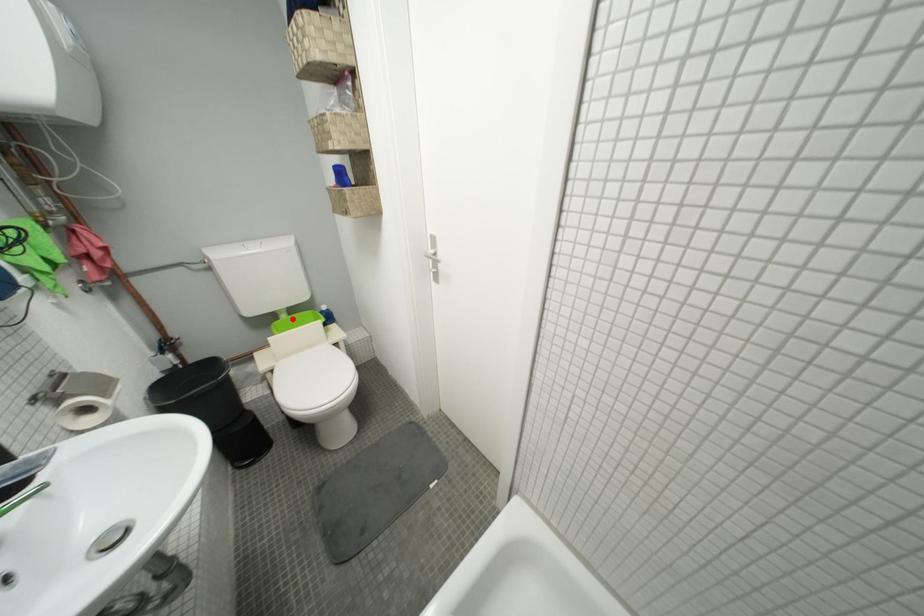
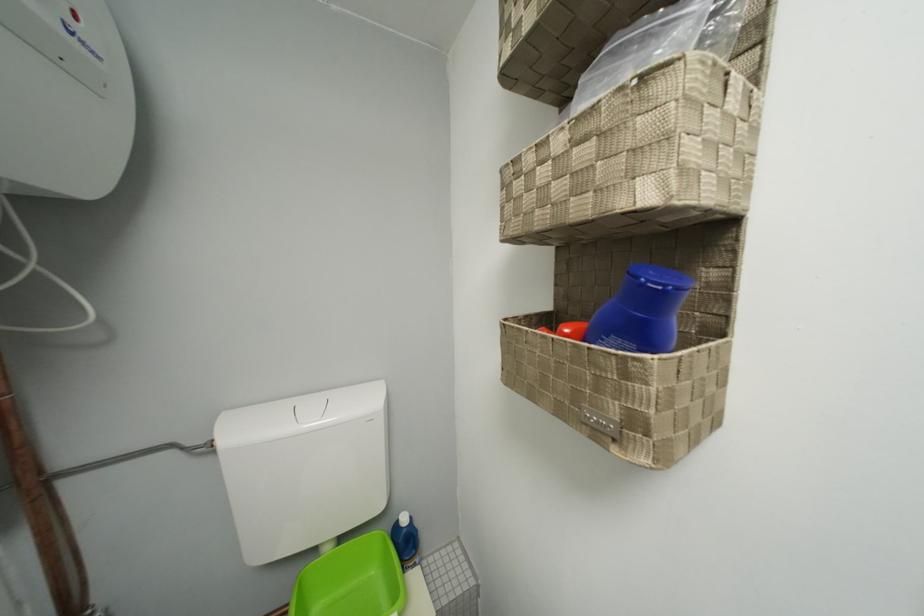
The point at the highlighted location is marked in the first image. Where is the corresponding point in the second image?

(335, 552)